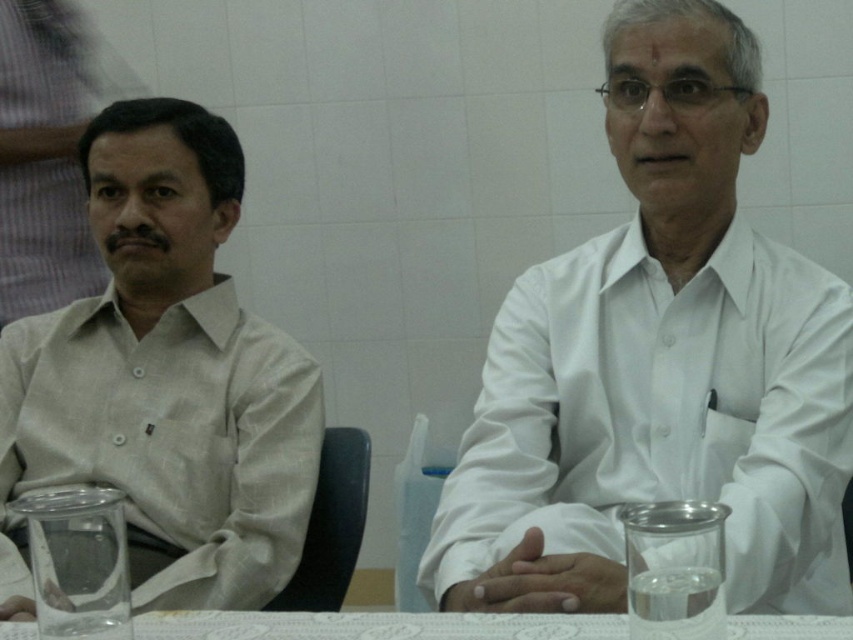
Question: Does white matte shirt at center have a greater width compared to light beige fabric shirt at left?

Choices:
 (A) no
 (B) yes

Answer: (B)

Question: Is white matte shirt at center bigger than white lace tablecloth at center?

Choices:
 (A) no
 (B) yes

Answer: (B)

Question: Among these objects, which one is nearest to the camera?

Choices:
 (A) white matte shirt at center
 (B) light beige fabric shirt at left
 (C) white lace tablecloth at center

Answer: (C)

Question: Which object appears farthest from the camera in this image?

Choices:
 (A) light beige fabric shirt at left
 (B) white matte shirt at center

Answer: (A)

Question: Can you confirm if white matte shirt at center is wider than white lace tablecloth at center?

Choices:
 (A) no
 (B) yes

Answer: (A)

Question: Which of the following is the closest to the observer?

Choices:
 (A) (490, 616)
 (B) (126, 397)

Answer: (A)